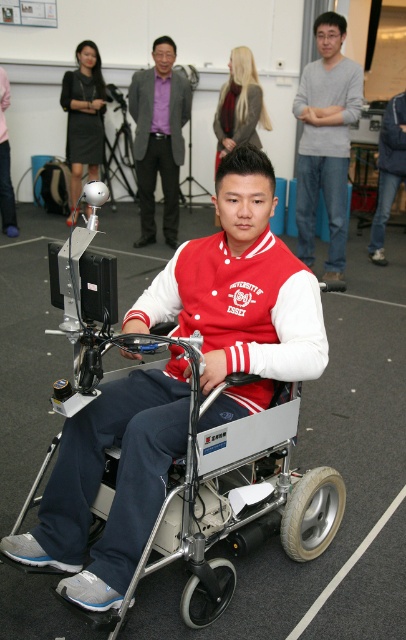
Between silver metallic mobility scooter at center and gray cotton shirt at upper center, which one has more height?

gray cotton shirt at upper center is taller.

Can you confirm if silver metallic mobility scooter at center is shorter than gray cotton shirt at upper center?

Yes, silver metallic mobility scooter at center is shorter than gray cotton shirt at upper center.

What are the coordinates of `silver metallic mobility scooter at center` in the screenshot? It's located at (x=239, y=497).

Which of these two, purple shirt at center or matte black dress at upper left, stands taller?

purple shirt at center

Can you confirm if purple shirt at center is bigger than matte black dress at upper left?

Yes.

Is point (142, 92) positioned before point (97, 58)?

That is True.

Find the location of `purple shirt at center`. purple shirt at center is located at coordinates (159, 138).

Can you confirm if silver metallic mobility scooter at center is positioned to the right of blonde hair at upper center?

Incorrect, silver metallic mobility scooter at center is not on the right side of blonde hair at upper center.

What do you see at coordinates (239, 497) in the screenshot? I see `silver metallic mobility scooter at center` at bounding box center [239, 497].

Which is in front, point (317, 515) or point (231, 88)?

Point (317, 515)

Image resolution: width=406 pixels, height=640 pixels. I want to click on silver metallic mobility scooter at center, so click(x=239, y=497).